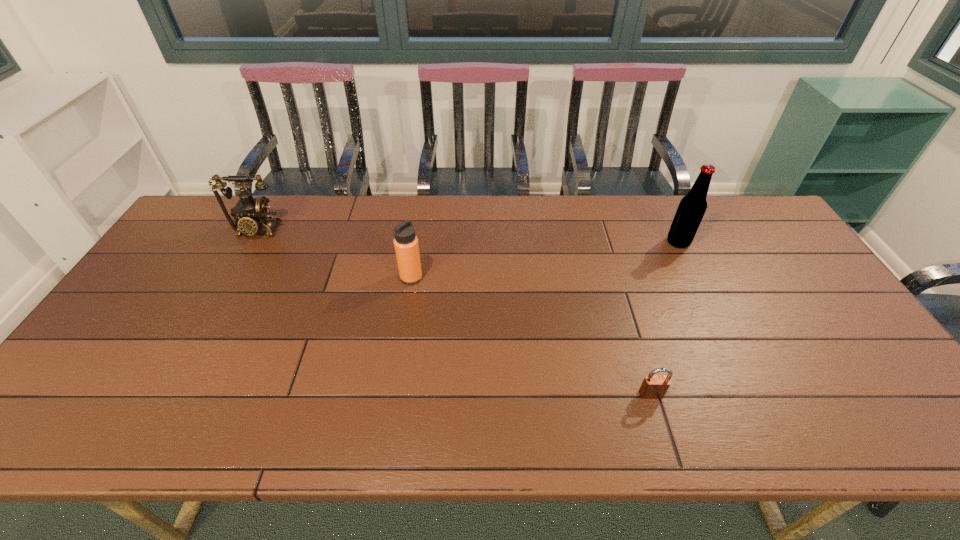
What are the coordinates of `vacant space located 0.050m on the front-facing side of the shortest object` in the screenshot? It's located at (659, 419).

I want to click on beer bottle positioned at the far edge, so click(x=692, y=207).

The height and width of the screenshot is (540, 960). Identify the location of telephone at the far edge. (253, 212).

Locate an element on the screen. object located at the left edge is located at coordinates (253, 212).

Find the location of `object that is positioned at the far left corner`. object that is positioned at the far left corner is located at coordinates (253, 212).

What are the coordinates of `vacant space at the far edge` in the screenshot? It's located at (477, 208).

The height and width of the screenshot is (540, 960). I want to click on blank space at the near edge, so click(436, 409).

Where is `vacant space at the left edge of the desktop`? vacant space at the left edge of the desktop is located at coordinates (168, 267).

Where is `vacant space at the far left corner of the desktop`? The image size is (960, 540). vacant space at the far left corner of the desktop is located at coordinates (220, 219).

In the image, there is a desktop. Where is `free space at the near left corner`? This screenshot has width=960, height=540. free space at the near left corner is located at coordinates (83, 410).